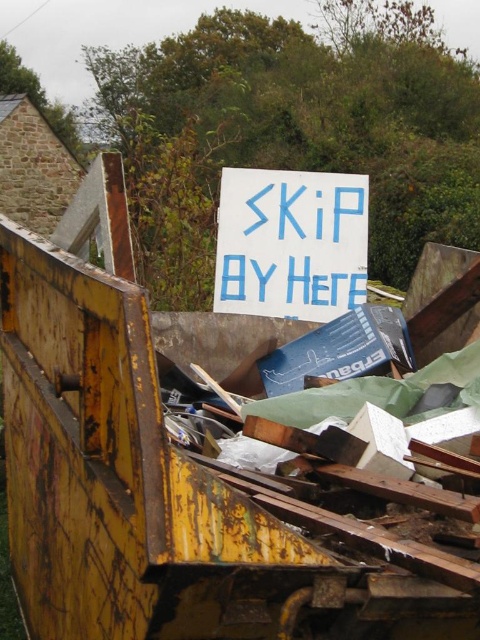
Question: Does rusty metal garbage truck at center appear over white paper sign at center?

Choices:
 (A) no
 (B) yes

Answer: (A)

Question: Does rusty metal garbage truck at center have a lesser width compared to white paper sign at center?

Choices:
 (A) yes
 (B) no

Answer: (B)

Question: Which point appears closest to the camera in this image?

Choices:
 (A) (276, 266)
 (B) (282, 424)

Answer: (B)

Question: Is rusty metal garbage truck at center wider than white paper sign at center?

Choices:
 (A) no
 (B) yes

Answer: (B)